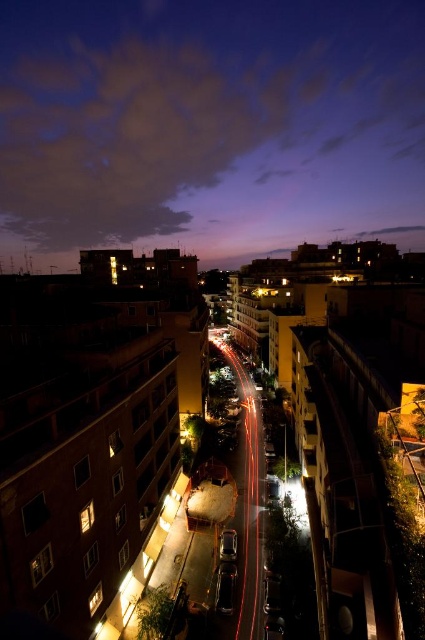
Is purple sky at upper center thinner than shiny silver car at center?

In fact, purple sky at upper center might be wider than shiny silver car at center.

Is point (229, 102) positioned before point (226, 540)?

No, it is not.

Where is `purple sky at upper center`? This screenshot has width=425, height=640. purple sky at upper center is located at coordinates (209, 128).